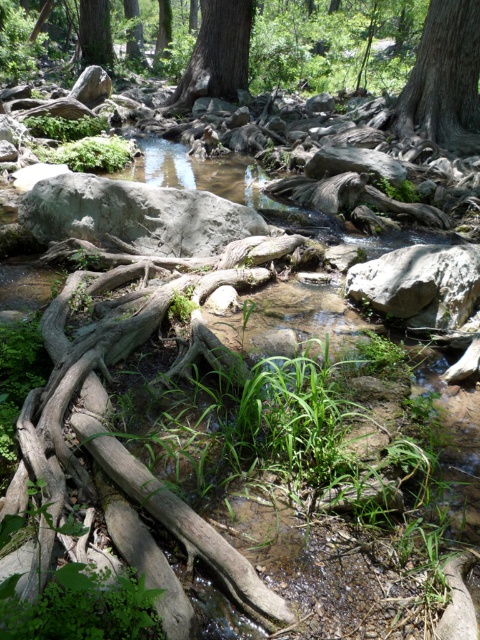
Who is lower down, brown rough tree roots at center or smooth gray bark at upper right?

brown rough tree roots at center is lower down.

Looking at this image, which of these two, brown rough tree roots at center or smooth gray bark at upper right, stands taller?

smooth gray bark at upper right

This screenshot has height=640, width=480. In order to click on brown rough tree roots at center in this screenshot , I will do `click(193, 532)`.

Who is more distant from viewer, [223,278] or [196,97]?

The point [196,97] is behind.

Between brown rough tree roots at center and smooth brown tree trunk at upper center, which one appears on the right side from the viewer's perspective?

brown rough tree roots at center is more to the right.

Is point (269, 611) positioned behind point (169, 99)?

No.

Locate an element on the screen. This screenshot has height=640, width=480. brown rough tree roots at center is located at coordinates pyautogui.click(x=193, y=532).

Between gray rough boulder at center and smooth gray bark at upper right, which one appears on the right side from the viewer's perspective?

smooth gray bark at upper right

How much distance is there between gray rough boulder at center and smooth gray bark at upper right?

gray rough boulder at center is 28.54 feet from smooth gray bark at upper right.

This screenshot has width=480, height=640. Identify the location of gray rough boulder at center. (135, 214).